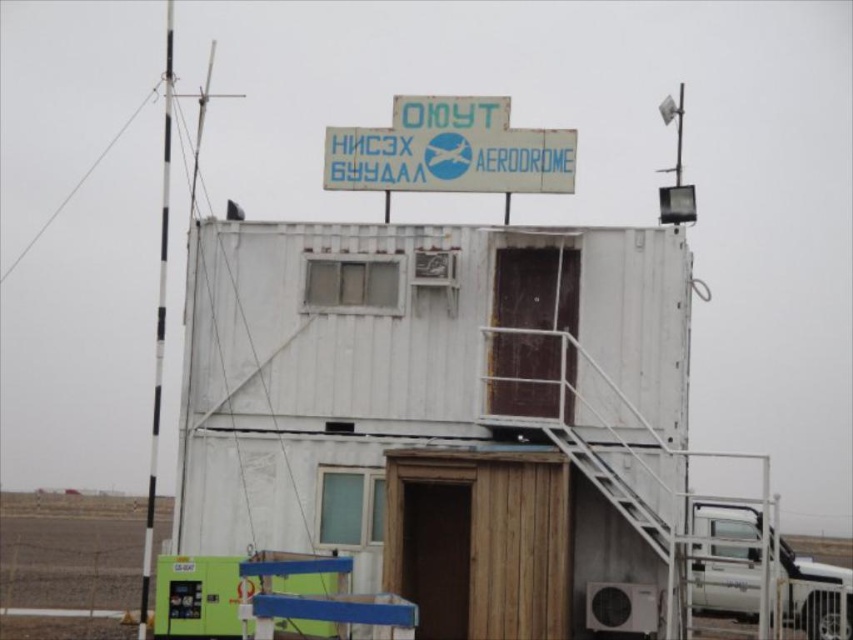
You are a pilot approaching the aerodrome and need to locate the control tower. Based on the image, where is the white wooden shed at center in relation to the white plastic sign at upper center?

The white wooden shed at center is located below the white plastic sign at upper center.

You are a delivery driver who needs to park your truck near the white wooden shed at center. Given that your truck is the same size as the white metallic truck at lower right, will there be enough space to park next to the shed?

→ The white wooden shed at center is larger than the white metallic truck at lower right. Since your truck is the same size as the white metallic truck at lower right, there should be sufficient space to park next to the shed as the shed itself occupies more area, leaving room for the truck.

You are standing in front of the aerodrome control tower and notice two points marked on the structure. The first point is at coordinates point (541, 192) and the second is at point (851, 572). Which of these points is closer to your current position?

Point (541, 192) is closer to the camera than point (851, 572), so the first point is closer to your current position.